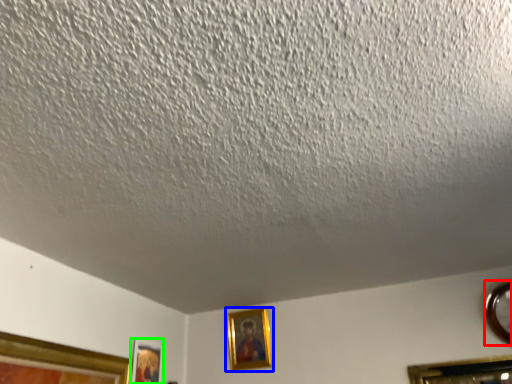
Question: Based on their relative distances, which object is farther from picture frame (highlighted by a red box)? Choose from picture frame (highlighted by a blue box) and picture frame (highlighted by a green box).

Choices:
 (A) picture frame
 (B) picture frame

Answer: (B)